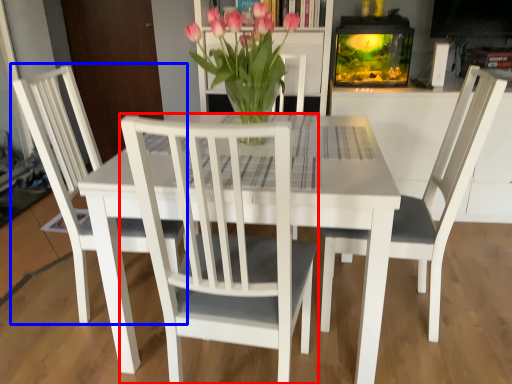
Question: Which of the following is the farthest to the observer, chair (highlighted by a red box) or chair (highlighted by a blue box)?

Choices:
 (A) chair
 (B) chair

Answer: (B)